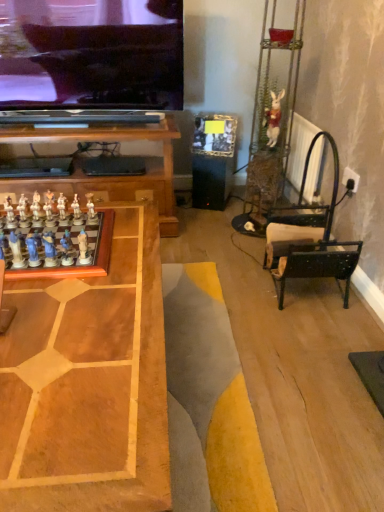
Identify the location of vacant area that is situated to the right of white glossy chess piece at center-left, which is the 3th toy from right to left. (124, 222).